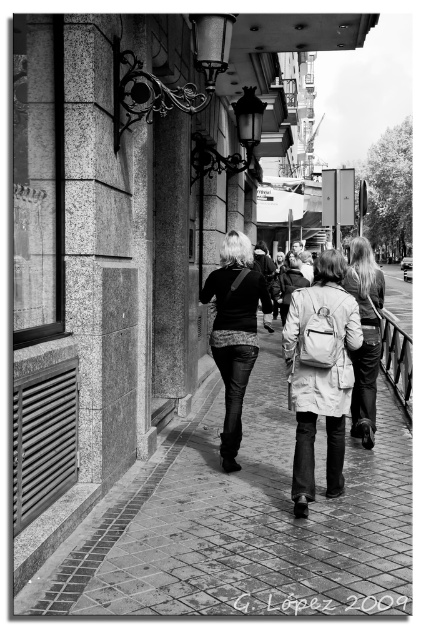
Question: Is light beige coat at center to the right of matte beige coat at center from the viewer's perspective?

Choices:
 (A) no
 (B) yes

Answer: (A)

Question: Can you confirm if brick pavement at center is positioned above light beige coat at center?

Choices:
 (A) no
 (B) yes

Answer: (A)

Question: Is leather jacket at center smaller than matte beige coat at center?

Choices:
 (A) no
 (B) yes

Answer: (B)

Question: Based on their relative distances, which object is nearer to the matte beige coat at center?

Choices:
 (A) light beige coat at center
 (B) brick pavement at center

Answer: (A)

Question: Which point appears farthest from the camera in this image?

Choices:
 (A) (302, 586)
 (B) (354, 257)
 (C) (215, 349)

Answer: (B)

Question: Which object is positioned farthest from the leather jacket at center?

Choices:
 (A) matte beige coat at center
 (B) light beige coat at center
 (C) brick pavement at center

Answer: (C)